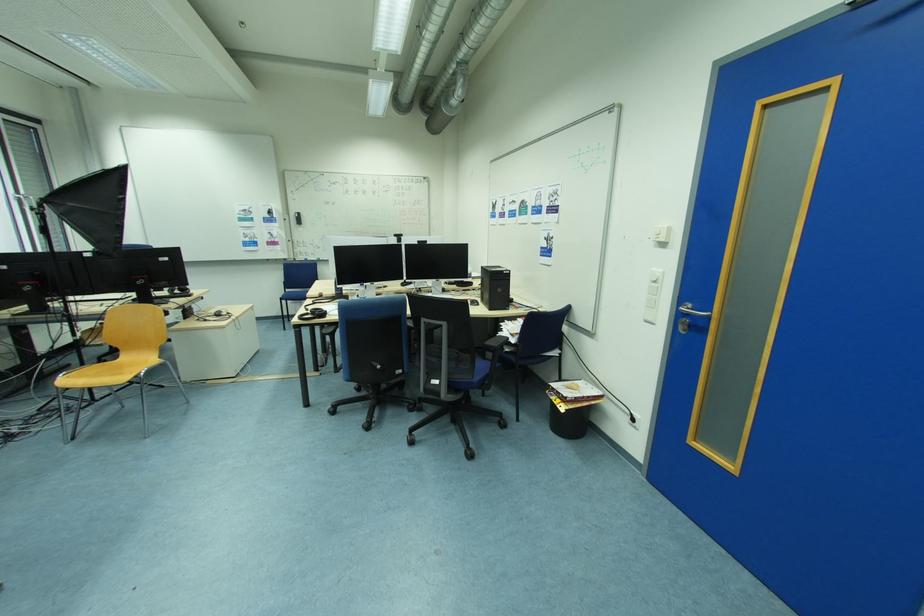
Where would you lift the black trash can? Please return your answer as a coordinate pair (x, y).

(567, 418)